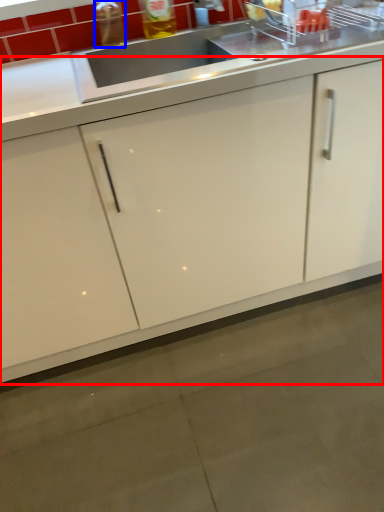
Question: Among these objects, which one is nearest to the camera, cabinetry (highlighted by a red box) or bottle (highlighted by a blue box)?

Choices:
 (A) cabinetry
 (B) bottle

Answer: (A)